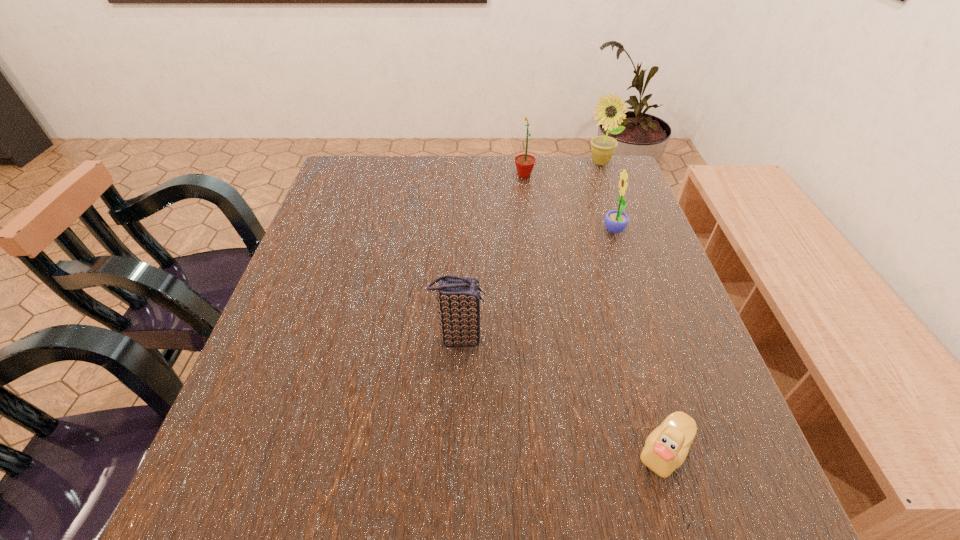
What are the coordinates of `free space at the far edge` in the screenshot? It's located at (432, 194).

Identify the location of vacant area at the left edge. (307, 333).

Locate an element on the screen. vacant space at the right edge is located at coordinates (672, 336).

Locate an element on the screen. This screenshot has width=960, height=540. blank area at the far left corner is located at coordinates (381, 197).

In order to click on blank space at the near left corner of the desktop in this screenshot , I will do `click(185, 517)`.

Locate an element on the screen. vacant space at the far right corner of the desktop is located at coordinates (584, 160).

Locate an element on the screen. This screenshot has width=960, height=540. free spot between the leftmost object and the nearest sunflower is located at coordinates pyautogui.click(x=537, y=285).

The image size is (960, 540). I want to click on free space between the shortest object and the nearest sunflower, so click(639, 341).

You are a GUI agent. You are given a task and a screenshot of the screen. Output one action in this format:
    pyautogui.click(x=<x>, y=<y>)
    Task: Click on the free area in between the fourth farthest object and the nearest sunflower
    This screenshot has height=540, width=960.
    Given the screenshot: What is the action you would take?
    pyautogui.click(x=537, y=285)

The height and width of the screenshot is (540, 960). Identify the location of vacant space in between the leftmost sunflower and the second nearest object. (492, 256).